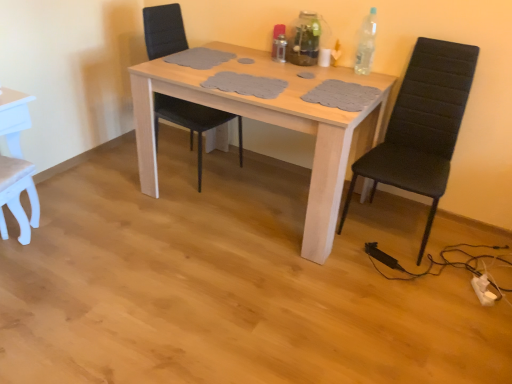
Question: Can you confirm if transparent glass vase at upper center, arranged as the 2th bottle when viewed from the right, is wider than black fabric chair at right, marked as the 1th chair in a right-to-left arrangement?

Choices:
 (A) yes
 (B) no

Answer: (B)

Question: From the image's perspective, is transparent glass vase at upper center, the 2th bottle in the left-to-right sequence, on top of black fabric chair at right, marked as the 3th chair in a left-to-right arrangement?

Choices:
 (A) no
 (B) yes

Answer: (B)

Question: Is the depth of transparent glass vase at upper center, the 2th bottle in the left-to-right sequence, greater than that of black fabric chair at right, marked as the 1th chair in a right-to-left arrangement?

Choices:
 (A) yes
 (B) no

Answer: (A)

Question: Is transparent glass vase at upper center, the 2th bottle in the left-to-right sequence, beside black fabric chair at right, marked as the 1th chair in a right-to-left arrangement?

Choices:
 (A) yes
 (B) no

Answer: (B)

Question: From a real-world perspective, is transparent glass vase at upper center, arranged as the 2th bottle when viewed from the right, positioned over black fabric chair at right, marked as the 1th chair in a right-to-left arrangement, based on gravity?

Choices:
 (A) no
 (B) yes

Answer: (B)

Question: Is transparent glass vase at upper center, arranged as the 2th bottle when viewed from the right, shorter than black fabric chair at right, marked as the 1th chair in a right-to-left arrangement?

Choices:
 (A) no
 (B) yes

Answer: (B)

Question: Are metallic silver bottle at upper center, the 1th bottle positioned from the left, and transparent glass vase at upper center, arranged as the 2th bottle when viewed from the right, located far from each other?

Choices:
 (A) no
 (B) yes

Answer: (A)

Question: Is metallic silver bottle at upper center, arranged as the third bottle when viewed from the right, positioned in front of transparent glass vase at upper center, the 2th bottle in the left-to-right sequence?

Choices:
 (A) no
 (B) yes

Answer: (A)

Question: Is metallic silver bottle at upper center, arranged as the third bottle when viewed from the right, aimed at transparent glass vase at upper center, arranged as the 2th bottle when viewed from the right?

Choices:
 (A) yes
 (B) no

Answer: (B)

Question: Is metallic silver bottle at upper center, arranged as the third bottle when viewed from the right, completely or partially outside of transparent glass vase at upper center, arranged as the 2th bottle when viewed from the right?

Choices:
 (A) no
 (B) yes

Answer: (B)

Question: Is metallic silver bottle at upper center, the 1th bottle positioned from the left, in contact with transparent glass vase at upper center, arranged as the 2th bottle when viewed from the right?

Choices:
 (A) yes
 (B) no

Answer: (B)

Question: Can you confirm if metallic silver bottle at upper center, arranged as the third bottle when viewed from the right, is positioned to the left of transparent glass vase at upper center, arranged as the 2th bottle when viewed from the right?

Choices:
 (A) yes
 (B) no

Answer: (A)

Question: Is black fabric chair at right, marked as the 3th chair in a left-to-right arrangement, a part of white matte chair at lower left, which is the third chair in right-to-left order?

Choices:
 (A) yes
 (B) no

Answer: (B)